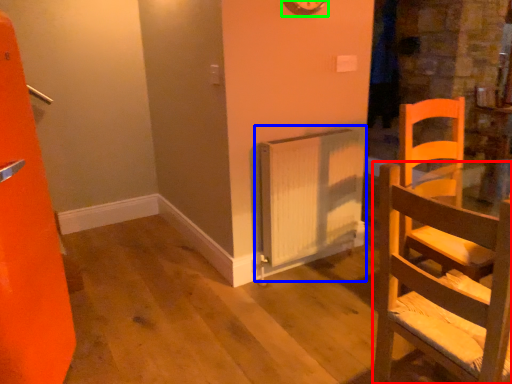
Question: Which object is the closest to the chair (highlighted by a red box)? Choose among these: radiator (highlighted by a blue box) or clock (highlighted by a green box).

Choices:
 (A) radiator
 (B) clock

Answer: (A)